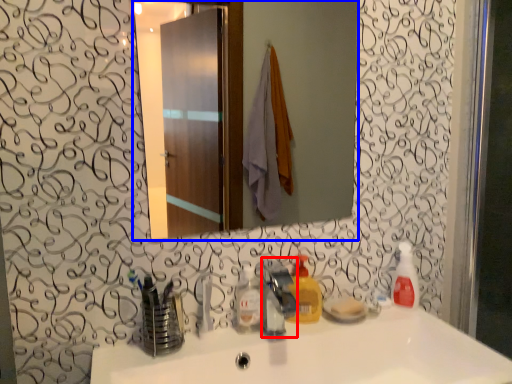
Question: Which point is further to the camera, faucet (highlighted by a red box) or mirror (highlighted by a blue box)?

Choices:
 (A) faucet
 (B) mirror

Answer: (B)